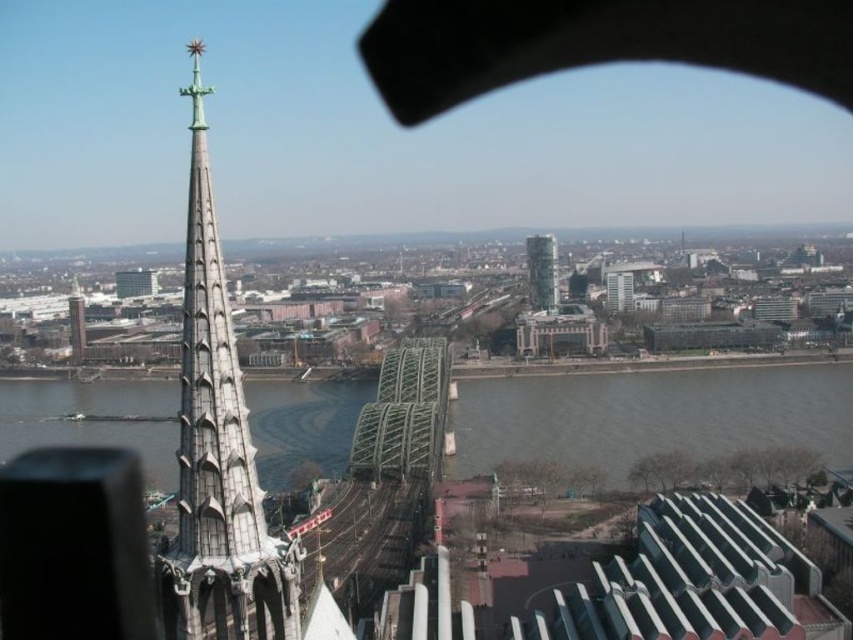
Between glassy reflective tower at center and matte gray tower at left, which one is positioned higher?

glassy reflective tower at center is higher up.

Is point (554, 305) positioned before point (74, 355)?

No, it is behind (74, 355).

Between point (555, 282) and point (80, 296), which one is positioned in front?

Point (80, 296)

Locate an element on the screen. The width and height of the screenshot is (853, 640). glassy reflective tower at center is located at coordinates (543, 269).

Is gray metallic water at center to the right of glassy reflective tower at center from the viewer's perspective?

In fact, gray metallic water at center is to the left of glassy reflective tower at center.

Can you confirm if gray metallic water at center is shorter than glassy reflective tower at center?

Correct, gray metallic water at center is not as tall as glassy reflective tower at center.

Locate an element on the screen. The width and height of the screenshot is (853, 640). gray metallic water at center is located at coordinates (650, 417).

Between gray metallic water at center and white stone spire at left, which one appears on the right side from the viewer's perspective?

white stone spire at left

Between gray metallic water at center and white stone spire at left, which one is positioned higher?

white stone spire at left is higher up.

Is point (264, 474) positioned behind point (294, 636)?

Yes, point (264, 474) is farther from viewer.

You are a GUI agent. You are given a task and a screenshot of the screen. Output one action in this format:
    pyautogui.click(x=<x>, y=<y>)
    Task: Click on the gray metallic water at center
    This screenshot has width=853, height=640.
    Given the screenshot: What is the action you would take?
    (650, 417)